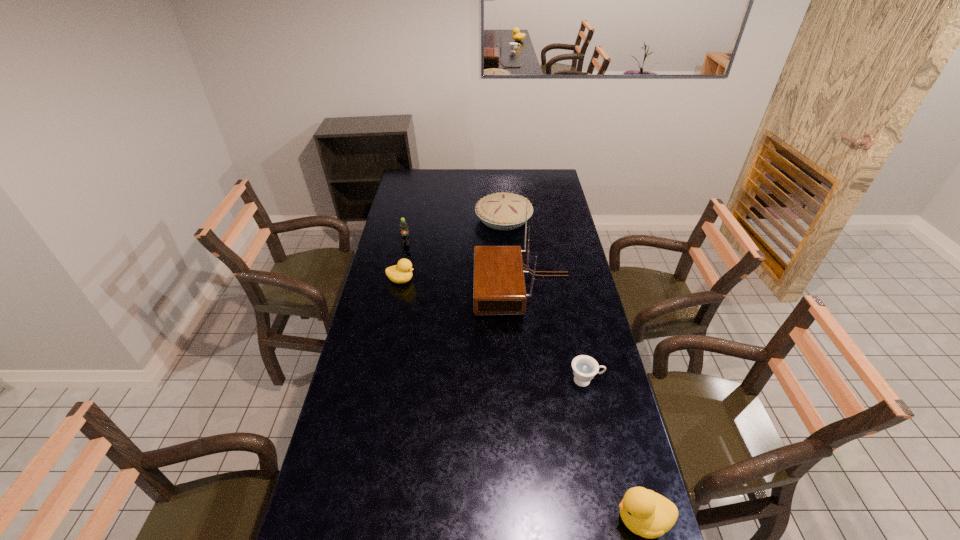
Where is `vacant region located on the front panel of the radio_receiver`? The image size is (960, 540). vacant region located on the front panel of the radio_receiver is located at coordinates (410, 288).

This screenshot has height=540, width=960. What are the coordinates of `vacant space situated on the front panel of the radio_receiver` in the screenshot? It's located at (436, 288).

This screenshot has height=540, width=960. In order to click on free space located on the front label of the soda in this screenshot , I will do `click(398, 282)`.

Find the location of a particular element. The width and height of the screenshot is (960, 540). duck located at the left edge is located at coordinates (402, 272).

Where is `soda that is at the left edge`? This screenshot has width=960, height=540. soda that is at the left edge is located at coordinates (404, 233).

At what (x,y) coordinates should I click in order to perform the action: click on radio_receiver that is at the right edge. Please return your answer as a coordinate pair (x, y). This screenshot has height=540, width=960. Looking at the image, I should click on (499, 285).

In order to click on teacup positioned at the right edge in this screenshot , I will do `click(585, 367)`.

In the image, there is a desktop. Find the location of `vacant space at the far edge`. vacant space at the far edge is located at coordinates (431, 179).

Image resolution: width=960 pixels, height=540 pixels. I want to click on free space at the near edge of the desktop, so click(x=483, y=509).

In the image, there is a desktop. At what (x,y) coordinates should I click in order to perform the action: click on vacant area at the left edge. Please return your answer as a coordinate pair (x, y). Looking at the image, I should click on (372, 313).